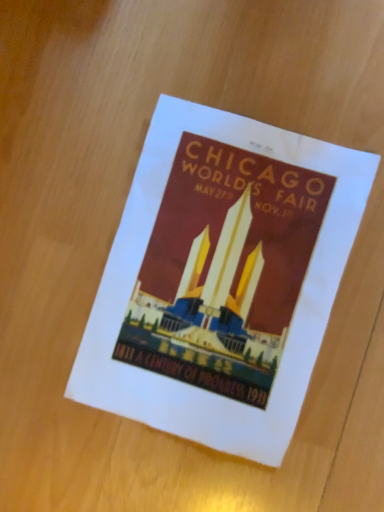
Measure the distance between point (x=276, y=199) and camera.

A distance of 15.75 inches exists between point (x=276, y=199) and camera.

The width and height of the screenshot is (384, 512). What do you see at coordinates (221, 279) in the screenshot?
I see `matte paper poster at center` at bounding box center [221, 279].

You are a GUI agent. You are given a task and a screenshot of the screen. Output one action in this format:
    pyautogui.click(x=<x>, y=<y>)
    Task: Click on the matte paper poster at center
    The height and width of the screenshot is (512, 384).
    Given the screenshot: What is the action you would take?
    pyautogui.click(x=221, y=279)

Find the location of a particular element. The image size is (384, 512). matte paper poster at center is located at coordinates (221, 279).